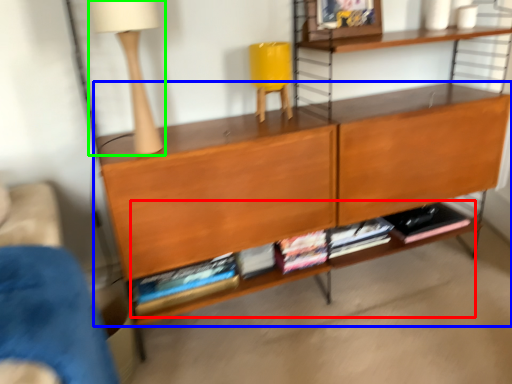
Question: Which object is positioned farthest from book (highlighted by a red box)? Select from shelf (highlighted by a blue box) and table lamp (highlighted by a green box).

Choices:
 (A) shelf
 (B) table lamp

Answer: (B)